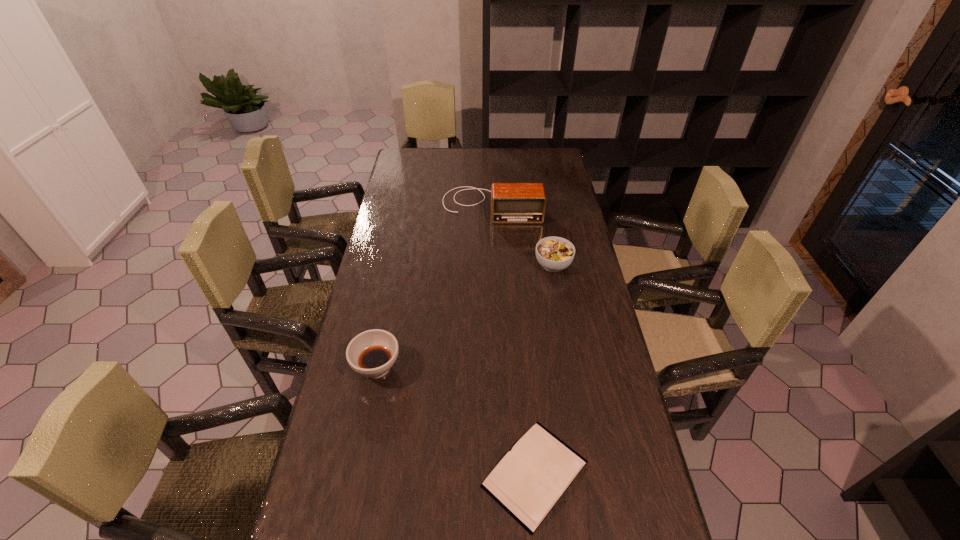
You are a GUI agent. You are given a task and a screenshot of the screen. Output one action in this format:
    pyautogui.click(x=<x>, y=<y>)
    Task: Click on the free space located on the left of the farther soup bowl
    This screenshot has width=960, height=540.
    Given the screenshot: What is the action you would take?
    pyautogui.click(x=515, y=265)

Find the location of `vacant space located on the back of the hardback book`. vacant space located on the back of the hardback book is located at coordinates (528, 392).

Image resolution: width=960 pixels, height=540 pixels. In order to click on object that is positioned at the left edge in this screenshot , I will do `click(372, 353)`.

This screenshot has height=540, width=960. Identify the location of radio receiver that is at the right edge. (510, 202).

Locate an element on the screen. The width and height of the screenshot is (960, 540). soup bowl at the right edge is located at coordinates (553, 253).

Where is `hardback book that is at the right edge`? hardback book that is at the right edge is located at coordinates (530, 479).

This screenshot has height=540, width=960. Identify the location of vacant region at the left edge of the desktop. (411, 207).

Locate an element on the screen. free space at the right edge of the desktop is located at coordinates (569, 194).

I want to click on vacant space at the far left corner of the desktop, so click(x=419, y=159).

You are a GUI agent. You are given a task and a screenshot of the screen. Output one action in this format:
    pyautogui.click(x=<x>, y=<y>)
    Task: Click on the free space at the far right corner
    This screenshot has height=540, width=960.
    Given the screenshot: What is the action you would take?
    pyautogui.click(x=549, y=151)